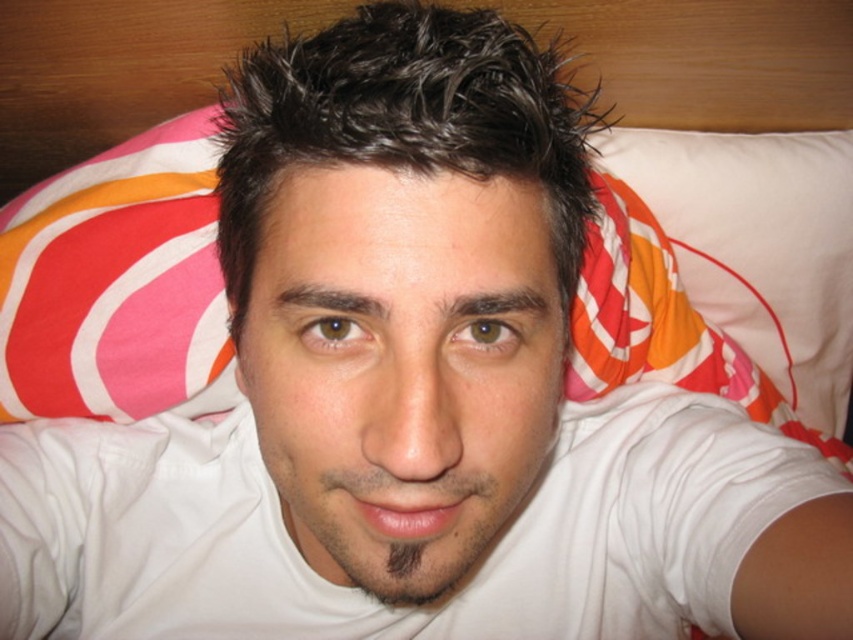
You are a photographer adjusting the camera to focus on two points in the image. The first point is at position point (503, 244) and the second is at point (264, 637). Which point should you focus on first if you want to capture the subject closest to the camera?

Point (503, 244) is in front of point (264, 637), so you should focus on point (503, 244) first as it is closer to the camera.

You are a photographer setting up a shoot. You need to ensure that the white matte head at center is visible above the white cotton shirt at center in the final image. Based on the scene description, will this arrangement be achievable?

Yes, the arrangement is achievable because the white matte head at center is located above the white cotton shirt at center, ensuring visibility.